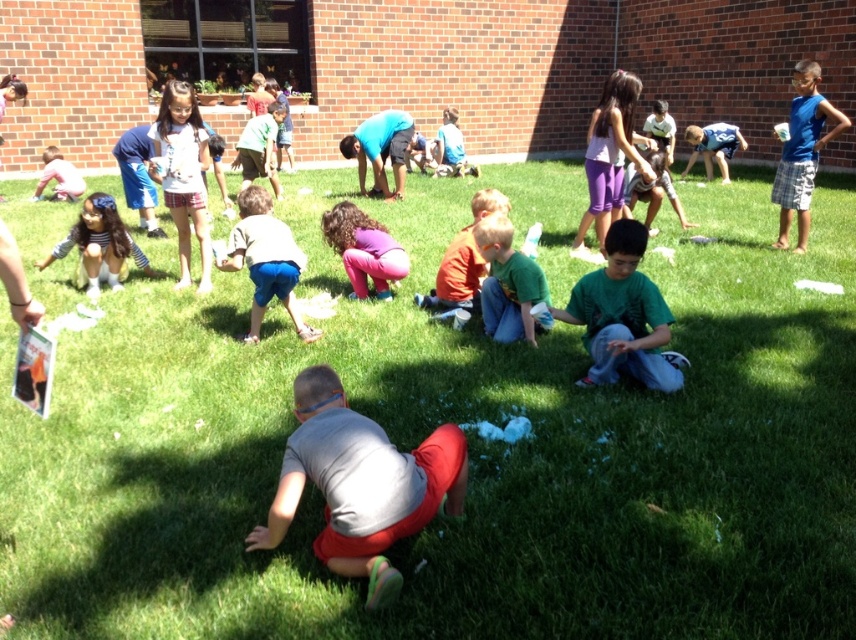
Which of these two, green matte shirt at center or orange shirt at center, stands taller?

Standing taller between the two is green matte shirt at center.

Does green matte shirt at center appear over orange shirt at center?

Incorrect, green matte shirt at center is not positioned above orange shirt at center.

The image size is (856, 640). In order to click on green matte shirt at center in this screenshot , I will do `click(508, 282)`.

How far apart are green matte shirt at center and pink fabric pants at center?

green matte shirt at center is 1.19 meters away from pink fabric pants at center.

Can you confirm if green matte shirt at center is positioned to the right of pink fabric pants at center?

Yes, green matte shirt at center is to the right of pink fabric pants at center.

Locate an element on the screen. This screenshot has height=640, width=856. green matte shirt at center is located at coordinates (508, 282).

Does blue plaid shorts at right have a lesser width compared to light pink shirt at lower left?

Yes, blue plaid shorts at right is thinner than light pink shirt at lower left.

What do you see at coordinates (801, 152) in the screenshot? I see `blue plaid shorts at right` at bounding box center [801, 152].

Is point (800, 122) more distant than point (67, 195)?

No.

This screenshot has width=856, height=640. I want to click on blue plaid shorts at right, so click(x=801, y=152).